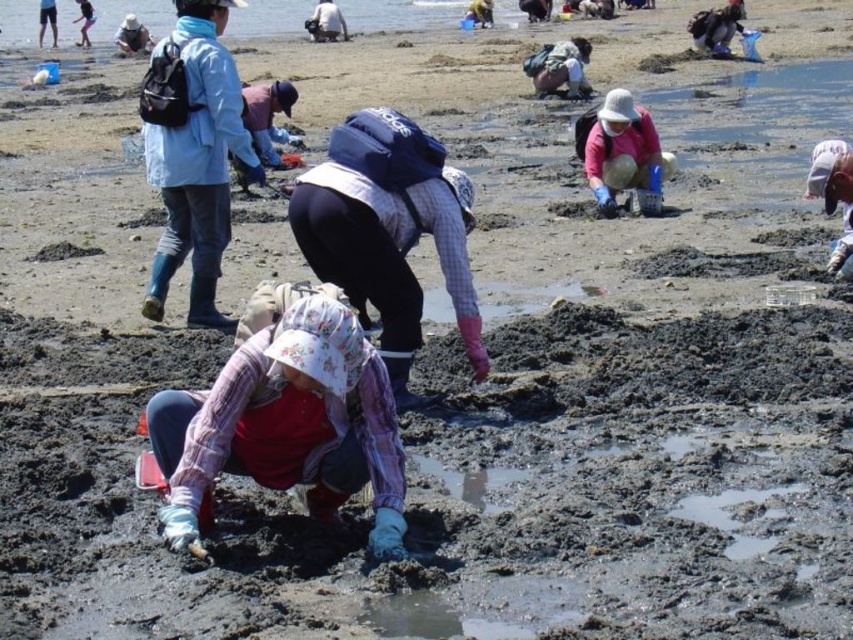
Question: Which point appears closest to the camera in this image?

Choices:
 (A) (410, 138)
 (B) (323, 497)
 (C) (151, 296)

Answer: (B)

Question: Which of the following is the farthest from the observer?

Choices:
 (A) plaid fabric shirt at center
 (B) light blue fabric jacket at upper left

Answer: (B)

Question: Which object is farther from the camera taking this photo?

Choices:
 (A) plaid fabric shirt at center
 (B) light blue fabric jacket at upper left

Answer: (B)

Question: Does plaid fabric hat at center appear on the right side of light blue fabric jacket at upper left?

Choices:
 (A) yes
 (B) no

Answer: (A)

Question: Is plaid fabric shirt at center to the right of light blue fabric jacket at upper left from the viewer's perspective?

Choices:
 (A) yes
 (B) no

Answer: (A)

Question: Does plaid fabric shirt at center appear under light blue fabric jacket at upper left?

Choices:
 (A) yes
 (B) no

Answer: (A)